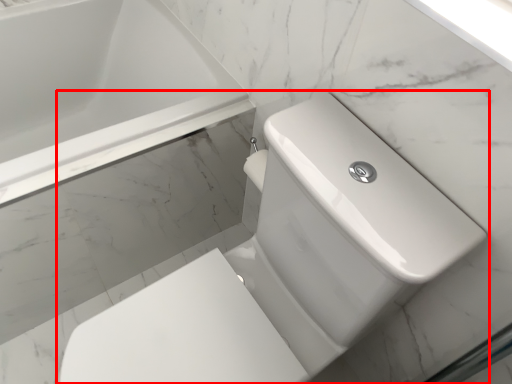
Question: From the image's perspective, considering the relative positions of toilet (annotated by the red box) and bathtub in the image provided, where is toilet (annotated by the red box) located with respect to the staircase?

Choices:
 (A) above
 (B) below

Answer: (B)